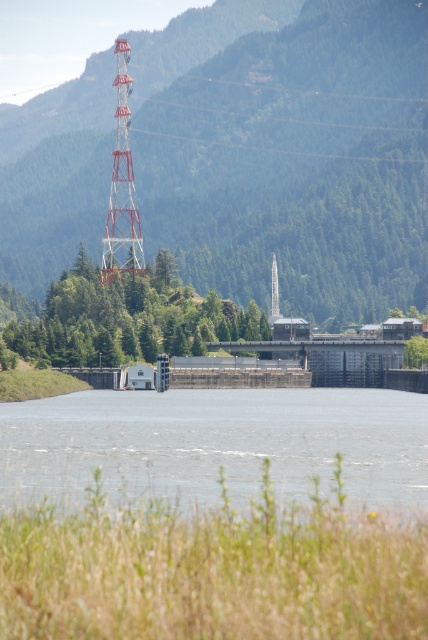
You are standing at a viewpoint near the hydroelectric dam and want to take a photo of the dam. The camera you are using has a focal length of 50mm. If you want to capture the entire dam structure in your photo, would the point at coordinate point (100, 433) be within the frame?

The point at coordinate point (100, 433) is 145.32 meters away from the camera. To determine if it is within the frame, you would need to calculate the field of view of the camera at 50mm focal length and compare it with the distance and position of the point. However, without additional information about the sensor size or the dimensions of the dam structure, it is not possible to definitively confirm if the point is within the frame.

You are standing at the point with coordinates point [118,67] and want to walk to the point with coordinates point [273,314]. Which direction should you face to walk towards your destination?

You should face towards the front because point [118,67] is behind point [273,314], so to reach your destination, you need to walk forward towards the point [273,314].

In the scene shown: You are a drone operator planning to fly a drone from the metallic red tower at upper left to the white metal tower at center. Based on the scene, will the drone have an unobstructed path between the two towers?

The metallic red tower at upper left is in front of the white metal tower at center, so the drone will not have an unobstructed path between the two towers because the metallic red tower at upper left blocks the path.